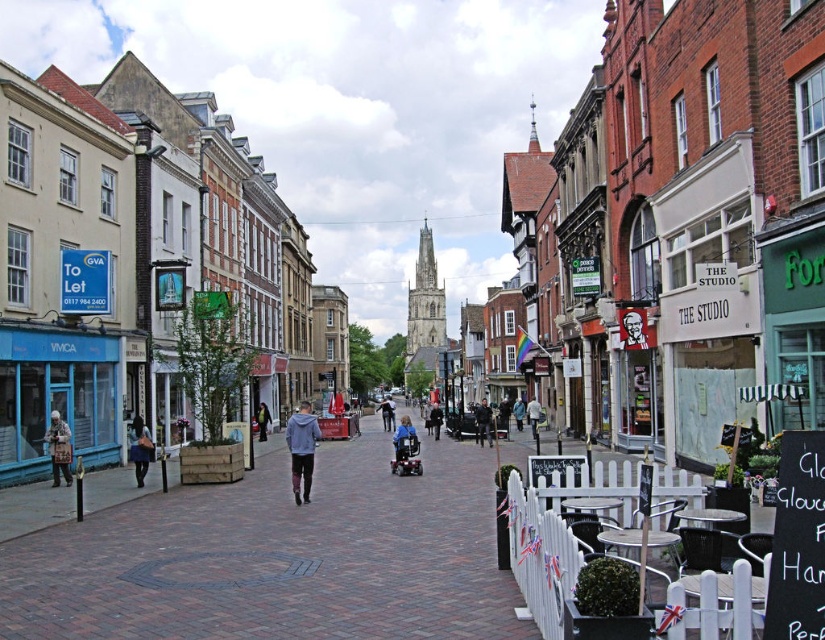
Question: Can you confirm if dark gray sweater at center is bigger than blue denim jacket at center?

Choices:
 (A) yes
 (B) no

Answer: (A)

Question: Estimate the real-world distances between objects in this image. Which object is farther from the dark blue jacket at lower left?

Choices:
 (A) green fabric jacket at center
 (B) dark blue jeans at center
 (C) patterned coat at left
 (D) brick paved at center

Answer: (B)

Question: Which point appears farthest from the camera in this image?

Choices:
 (A) (59, 433)
 (B) (142, 486)
 (C) (491, 424)
 (D) (295, 420)

Answer: (C)

Question: Among these points, which one is nearest to the camera?

Choices:
 (A) (297, 429)
 (B) (432, 419)

Answer: (A)

Question: Is light blue hoodie at center smaller than patterned coat at left?

Choices:
 (A) yes
 (B) no

Answer: (B)

Question: Is light blue denim jacket at center thinner than dark gray jacket at center?

Choices:
 (A) yes
 (B) no

Answer: (B)